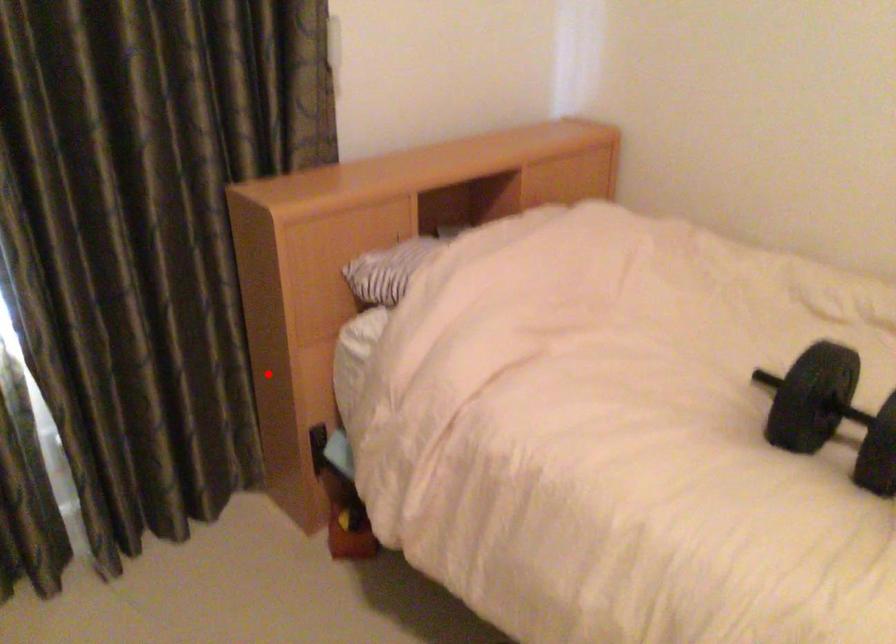
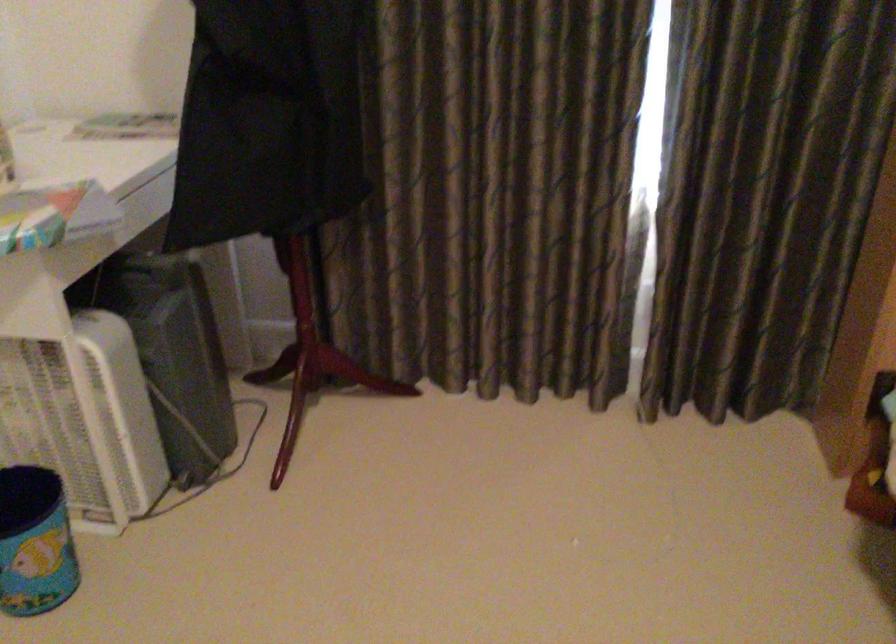
The point at the highlighted location is marked in the first image. Where is the corresponding point in the second image?

(865, 298)